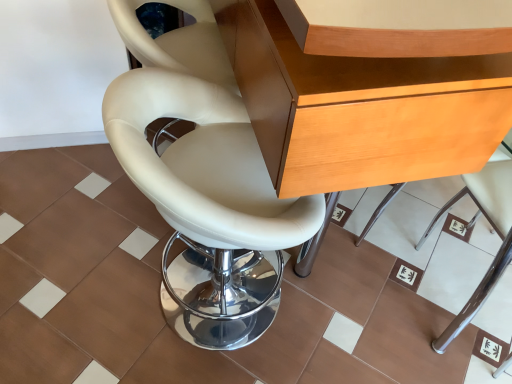
Question: Considering the positions of wooden desk at center and white leather chair at lower right, the second chair viewed from the left, in the image, is wooden desk at center wider or thinner than white leather chair at lower right, the second chair viewed from the left,?

Choices:
 (A) thin
 (B) wide

Answer: (B)

Question: In terms of height, does wooden desk at center look taller or shorter compared to white leather chair at lower right, the second chair viewed from the left?

Choices:
 (A) short
 (B) tall

Answer: (B)

Question: Which object is positioned closest to the brown matte tile at center?

Choices:
 (A) wooden desk at center
 (B) white leather chair at center, which appears as the 2th chair when viewed from the right
 (C) white leather chair at lower right, which is the first chair from right to left

Answer: (C)

Question: Estimate the real-world distances between objects in this image. Which object is farther from the brown matte tile at center?

Choices:
 (A) wooden desk at center
 (B) white leather chair at lower right, the second chair viewed from the left
 (C) white leather chair at center, which appears as the 2th chair when viewed from the right

Answer: (A)